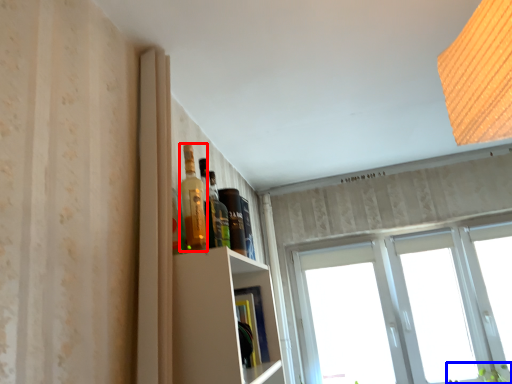
Question: Among these objects, which one is nearest to the camera, bottle (highlighted by a red box) or plant (highlighted by a blue box)?

Choices:
 (A) bottle
 (B) plant

Answer: (A)